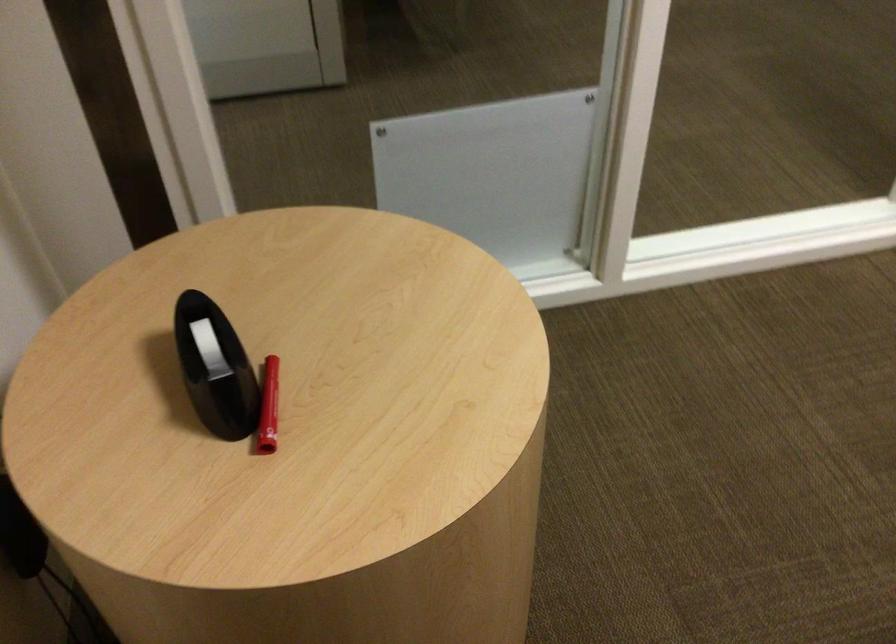
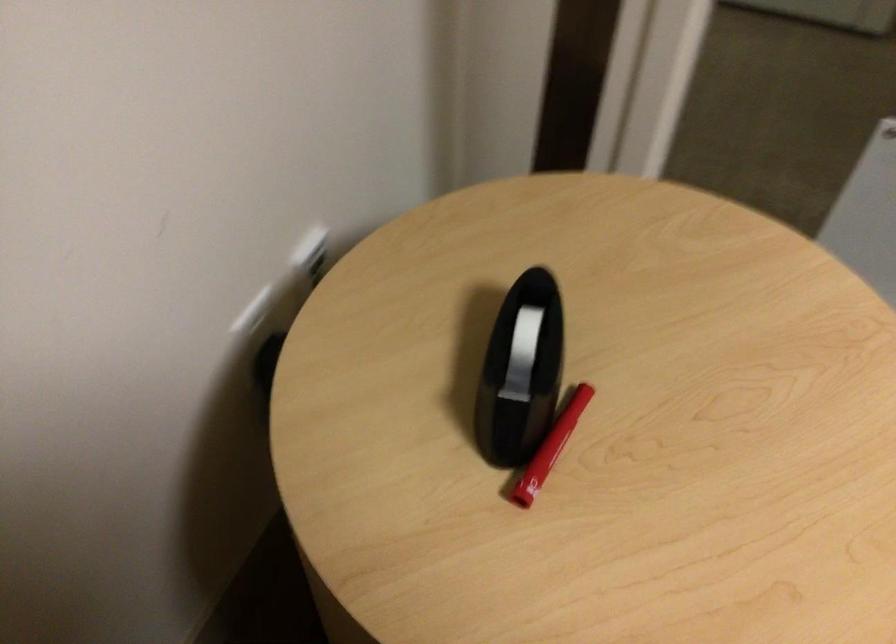
In the second image, find the point that corresponds to pixel 280 462 in the first image.

(527, 511)